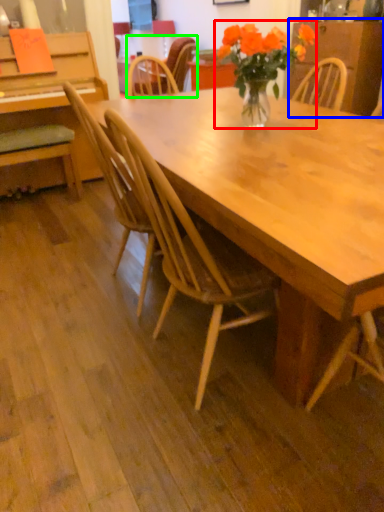
Question: Based on their relative distances, which object is nearer to houseplant (highlighted by a red box)? Choose from dresser (highlighted by a blue box) and chair (highlighted by a green box).

Choices:
 (A) dresser
 (B) chair

Answer: (B)